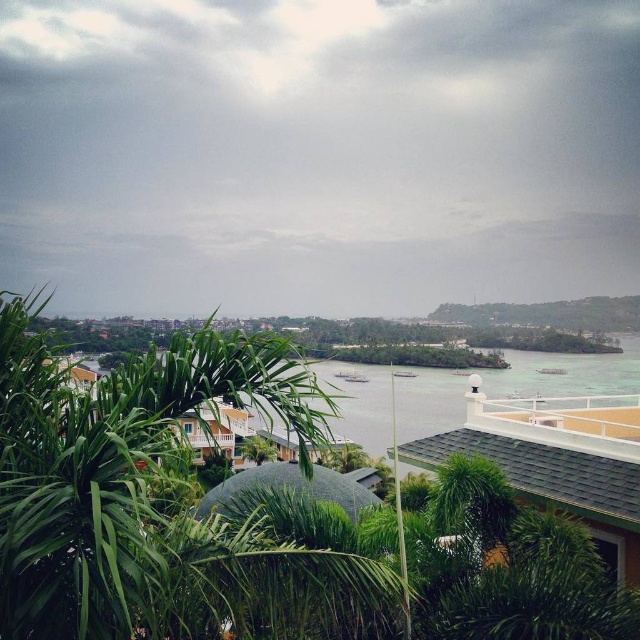
Is green leafy vegetation at center wider than clear water at center?

In fact, green leafy vegetation at center might be narrower than clear water at center.

Measure the distance between green leafy vegetation at center and camera.

A distance of 4.14 meters exists between green leafy vegetation at center and camera.

Where is `green leafy vegetation at center`? The width and height of the screenshot is (640, 640). green leafy vegetation at center is located at coordinates (157, 502).